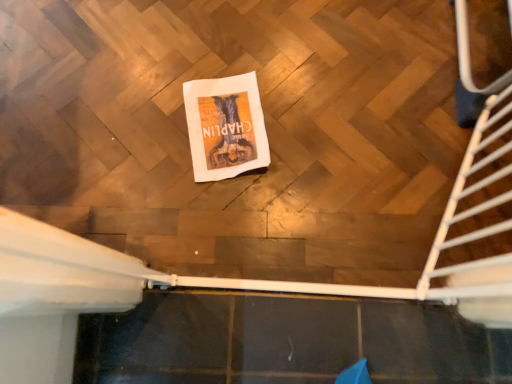
Question: Does white metal stairs at right have a smaller size compared to white paper towel at center?

Choices:
 (A) no
 (B) yes

Answer: (A)

Question: From a real-world perspective, is white metal stairs at right physically below white paper towel at center?

Choices:
 (A) no
 (B) yes

Answer: (A)

Question: Considering the relative sizes of white metal stairs at right and white paper towel at center in the image provided, is white metal stairs at right thinner than white paper towel at center?

Choices:
 (A) yes
 (B) no

Answer: (A)

Question: Is white metal stairs at right not inside white paper towel at center?

Choices:
 (A) no
 (B) yes

Answer: (B)

Question: Considering the relative sizes of white metal stairs at right and white paper towel at center in the image provided, is white metal stairs at right taller than white paper towel at center?

Choices:
 (A) yes
 (B) no

Answer: (A)

Question: Is white metal stairs at right bigger than white paper towel at center?

Choices:
 (A) no
 (B) yes

Answer: (B)

Question: Does white paper towel at center have a lesser width compared to white metal stairs at right?

Choices:
 (A) no
 (B) yes

Answer: (A)

Question: Does white paper towel at center contain white metal stairs at right?

Choices:
 (A) no
 (B) yes

Answer: (A)

Question: Considering the relative positions of white paper towel at center and white metal stairs at right in the image provided, is white paper towel at center to the left of white metal stairs at right from the viewer's perspective?

Choices:
 (A) yes
 (B) no

Answer: (A)

Question: Is white paper towel at center positioned with its back to white metal stairs at right?

Choices:
 (A) yes
 (B) no

Answer: (B)

Question: Does white paper towel at center have a greater height compared to white metal stairs at right?

Choices:
 (A) yes
 (B) no

Answer: (B)

Question: Does white paper towel at center appear on the right side of white metal stairs at right?

Choices:
 (A) no
 (B) yes

Answer: (A)

Question: From the image's perspective, is white paper towel at center positioned above or below white metal stairs at right?

Choices:
 (A) above
 (B) below

Answer: (A)